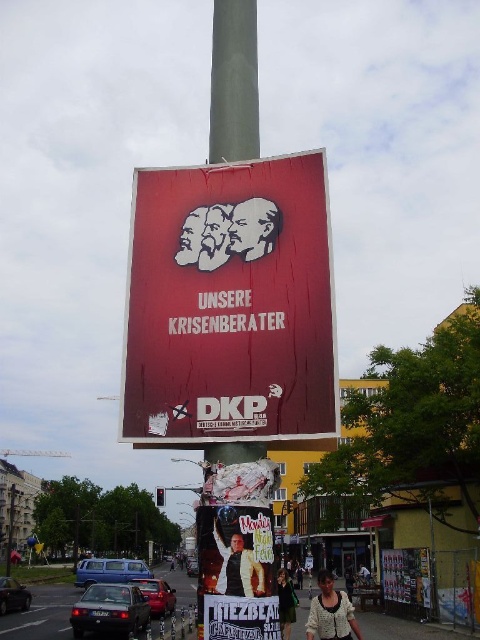
Who is taller, metallic silver poster at center or yellow leather jacket at center?

metallic silver poster at center

Image resolution: width=480 pixels, height=640 pixels. What do you see at coordinates (407, 576) in the screenshot?
I see `metallic silver poster at center` at bounding box center [407, 576].

Where is `metallic silver poster at center`? metallic silver poster at center is located at coordinates (407, 576).

Can you confirm if metallic silver poster at center is shorter than green fabric dress at lower center?

Indeed, metallic silver poster at center has a lesser height compared to green fabric dress at lower center.

Can you confirm if metallic silver poster at center is positioned to the left of green fabric dress at lower center?

No, metallic silver poster at center is not to the left of green fabric dress at lower center.

Image resolution: width=480 pixels, height=640 pixels. Identify the location of metallic silver poster at center. (407, 576).

Is rusty metal poster at upper center to the left of yellow leather jacket at center from the viewer's perspective?

Yes, rusty metal poster at upper center is to the left of yellow leather jacket at center.

Who is more forward, (332, 356) or (238, 541)?

Point (238, 541) is in front.

Image resolution: width=480 pixels, height=640 pixels. What are the coordinates of `rusty metal poster at upper center` in the screenshot? It's located at (229, 305).